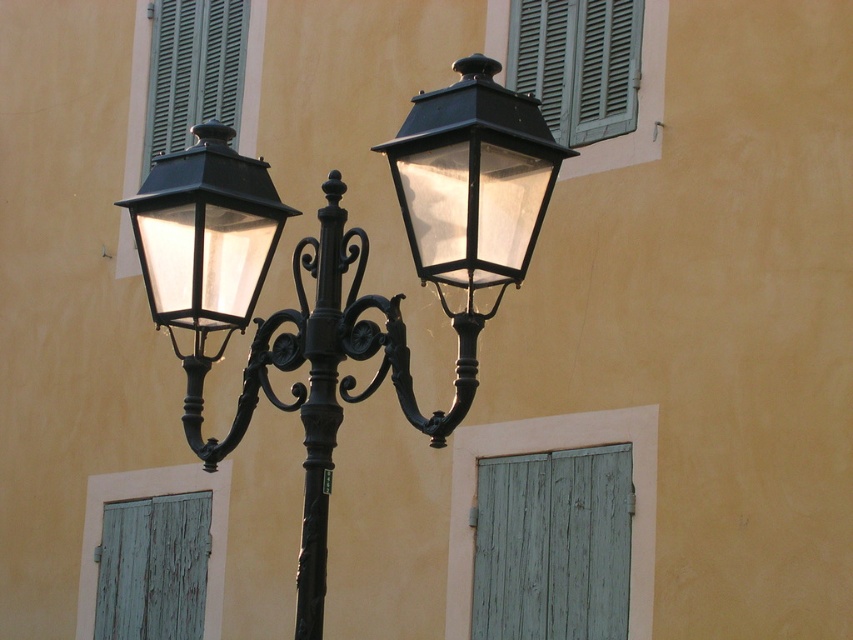
Question: Is green weathered wood at lower right wider than matte black lantern at center?

Choices:
 (A) yes
 (B) no

Answer: (A)

Question: Is matte black street light at center thinner than black wrought iron pole at center?

Choices:
 (A) yes
 (B) no

Answer: (A)

Question: Considering the real-world distances, which object is farthest from the black wrought iron pole at center?

Choices:
 (A) peeling teal shutter at lower left
 (B) green matte shutters at upper right
 (C) green weathered wood at lower right

Answer: (A)

Question: Estimate the real-world distances between objects in this image. Which object is farther from the green weathered wood at lower right?

Choices:
 (A) peeling teal shutter at lower left
 (B) green matte shutter at upper left
 (C) black wrought iron pole at center

Answer: (C)

Question: Which object appears farthest from the camera in this image?

Choices:
 (A) green matte shutters at upper right
 (B) green weathered wood at lower right
 (C) black wrought iron pole at center

Answer: (A)

Question: Is peeling teal shutter at lower left to the left of black wrought iron pole at center from the viewer's perspective?

Choices:
 (A) no
 (B) yes

Answer: (B)